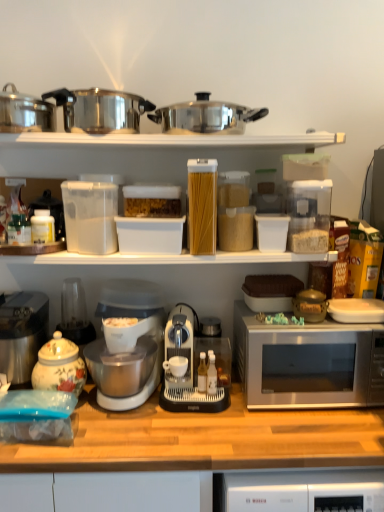
Describe the element at coordinates (25, 112) in the screenshot. I see `stainless steel pot at upper left` at that location.

The image size is (384, 512). Describe the element at coordinates (194, 368) in the screenshot. I see `white plastic coffee machine at center` at that location.

This screenshot has width=384, height=512. I want to click on shiny metallic crock pot at upper center, the first crock pot positioned from the left, so click(100, 110).

Identify the location of white plastic containers at upper center. (170, 140).

Image resolution: width=384 pixels, height=512 pixels. What are the coordinates of `stainless steel pot at upper left` in the screenshot? It's located at (25, 112).

From the image's perspective, would you say satin silver microwave at right is positioned over white plastic coffee machine at center?

Actually, satin silver microwave at right appears below white plastic coffee machine at center in the image.

Considering the sizes of satin silver microwave at right and white plastic coffee machine at center in the image, is satin silver microwave at right wider or thinner than white plastic coffee machine at center?

Clearly, satin silver microwave at right has more width compared to white plastic coffee machine at center.

From a real-world perspective, between satin silver microwave at right and white plastic coffee machine at center, who is vertically higher?

white plastic coffee machine at center, from a real-world perspective.

Is satin silver microwave at right oriented towards white plastic coffee machine at center?

No, satin silver microwave at right is not facing towards white plastic coffee machine at center.

From the image's perspective, is white plastic mixer at center positioned above or below satin silver microwave at right?

Based on their image positions, white plastic mixer at center is located above satin silver microwave at right.

Is white plastic mixer at center to the left of satin silver microwave at right from the viewer's perspective?

Correct, you'll find white plastic mixer at center to the left of satin silver microwave at right.

Can you confirm if white plastic mixer at center is wider than satin silver microwave at right?

Yes, white plastic mixer at center is wider than satin silver microwave at right.

From a real-world perspective, is polished stainless steel pot at upper center, positioned as the 1th crock pot in right-to-left order, above or below white plastic coffee machine at center?

polished stainless steel pot at upper center, positioned as the 1th crock pot in right-to-left order, is above white plastic coffee machine at center.

Which of these two, polished stainless steel pot at upper center, the 2th crock pot when ordered from left to right, or white plastic coffee machine at center, stands shorter?

Standing shorter between the two is polished stainless steel pot at upper center, the 2th crock pot when ordered from left to right.

Does polished stainless steel pot at upper center, the 2th crock pot when ordered from left to right, touch white plastic coffee machine at center?

polished stainless steel pot at upper center, the 2th crock pot when ordered from left to right, is not next to white plastic coffee machine at center, and they're not touching.

Does translucent plastic container at center turn towards stainless steel pot at upper left?

No.

Is stainless steel pot at upper left located within translucent plastic container at center?

Definitely not — stainless steel pot at upper left is not inside translucent plastic container at center.

Considering the positions of objects translucent plastic container at center and stainless steel pot at upper left in the image provided, who is more to the left, translucent plastic container at center or stainless steel pot at upper left?

stainless steel pot at upper left.

In the scene shown: From the image's perspective, is polished stainless steel pot at upper center, positioned as the 1th crock pot in right-to-left order, above white plastic mixer at center?

Yes, from the image's perspective, polished stainless steel pot at upper center, positioned as the 1th crock pot in right-to-left order, is on top of white plastic mixer at center.

Which point is more forward, (234, 111) or (84, 353)?

Point (234, 111)

Which is more to the right, polished stainless steel pot at upper center, the 2th crock pot when ordered from left to right, or white plastic mixer at center?

From the viewer's perspective, polished stainless steel pot at upper center, the 2th crock pot when ordered from left to right, appears more on the right side.

What's the angular difference between polished stainless steel pot at upper center, the 2th crock pot when ordered from left to right, and white plastic mixer at center's facing directions?

The angle between the facing direction of polished stainless steel pot at upper center, the 2th crock pot when ordered from left to right, and the facing direction of white plastic mixer at center is 1.35 degrees.

From the picture: Is the surface of satin silver microwave at right in direct contact with stainless steel coffee maker at left?

satin silver microwave at right and stainless steel coffee maker at left are not in contact.

Considering the sizes of objects satin silver microwave at right and stainless steel coffee maker at left in the image provided, who is smaller, satin silver microwave at right or stainless steel coffee maker at left?

stainless steel coffee maker at left.

From the picture: From a real-world perspective, does satin silver microwave at right sit lower than stainless steel coffee maker at left?

Correct, in the physical world, satin silver microwave at right is lower than stainless steel coffee maker at left.

Considering the relative positions of stainless steel coffee maker at left and satin silver microwave at right in the image provided, is stainless steel coffee maker at left behind satin silver microwave at right?

Yes, the depth of stainless steel coffee maker at left is greater than that of satin silver microwave at right.

From the image's perspective, which is below, stainless steel coffee maker at left or satin silver microwave at right?

satin silver microwave at right.

Is stainless steel coffee maker at left positioned with its back to satin silver microwave at right?

No, stainless steel coffee maker at left is not facing away from satin silver microwave at right.

From a real-world perspective, which object rests below the other?

satin silver microwave at right.

Identify the location of appliance above the satin silver microwave at right (from a real-world perspective). (194, 368).

You are a GUI agent. You are given a task and a screenshot of the screen. Output one action in this format:
    pyautogui.click(x=<x>, y=<y>)
    Task: Click on the mixer on the left of the satin silver microwave at right
    This screenshot has height=512, width=384.
    Given the screenshot: What is the action you would take?
    pyautogui.click(x=131, y=333)

From the image, which object appears to be farther from polished stainless steel pot at upper center, the 2th crock pot when ordered from left to right, porcelain floral tea pot at left or satin silver microwave at right?

The object further to polished stainless steel pot at upper center, the 2th crock pot when ordered from left to right, is porcelain floral tea pot at left.

Considering their positions, is shiny metallic crock pot at upper center, the second crock pot positioned from the right, positioned closer to wooden at lower center than stainless steel pot at upper left?

Based on the image, shiny metallic crock pot at upper center, the second crock pot positioned from the right, appears to be nearer to wooden at lower center.

Estimate the real-world distances between objects in this image. Which object is closer to wooden at lower center, polished stainless steel pot at upper center, the 2th crock pot when ordered from left to right, or stainless steel coffee maker at left?

The object closer to wooden at lower center is stainless steel coffee maker at left.

From the image, which object appears to be nearer to stainless steel coffee maker at left, translucent plastic container at center or wooden at lower center?

Based on the image, wooden at lower center appears to be nearer to stainless steel coffee maker at left.

When comparing their distances from translucent plastic container at center, does porcelain floral tea pot at left or shiny metallic crock pot at upper center, the second crock pot positioned from the right, seem further?

Based on the image, porcelain floral tea pot at left appears to be further to translucent plastic container at center.

Which object lies nearer to the anchor point satin silver microwave at right, polished stainless steel pot at upper center, the 2th crock pot when ordered from left to right, or white plastic mixer at center?

white plastic mixer at center lies closer to satin silver microwave at right than the other object.

Based on their spatial positions, is porcelain floral tea pot at left or stainless steel pot at upper left further from translucent plastic container at center?

porcelain floral tea pot at left.

Considering their positions, is white plastic coffee machine at center positioned closer to porcelain floral tea pot at left than satin silver microwave at right?

white plastic coffee machine at center is positioned closer to the anchor porcelain floral tea pot at left.

This screenshot has width=384, height=512. I want to click on mixer situated between stainless steel pot at upper left and satin silver microwave at right from left to right, so click(x=131, y=333).

Find the location of `appliance between polished stainless steel pot at upper center, the 2th crock pot when ordered from left to right, and wooden at lower center vertically`. appliance between polished stainless steel pot at upper center, the 2th crock pot when ordered from left to right, and wooden at lower center vertically is located at coordinates (194, 368).

Locate an element on the screen. shelf between polished stainless steel pot at upper center, positioned as the 1th crock pot in right-to-left order, and white plastic mixer at center, in the vertical direction is located at coordinates (170, 140).

Locate an element on the screen. Image resolution: width=384 pixels, height=512 pixels. shelf between shiny metallic crock pot at upper center, the first crock pot positioned from the left, and white plastic mixer at center, in the vertical direction is located at coordinates (170, 140).